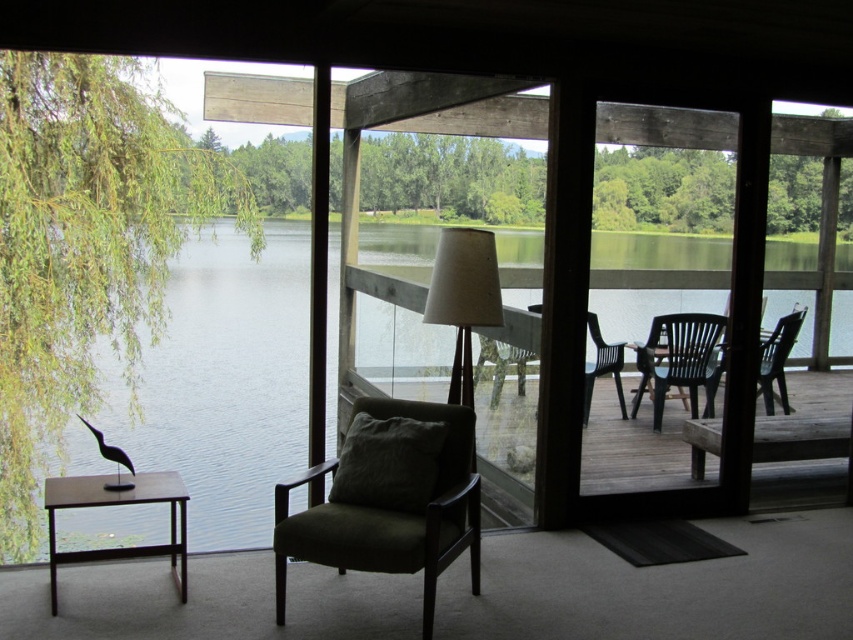
Can you confirm if transparent glass screen door at center is thinner than green water at center?

Yes, transparent glass screen door at center is thinner than green water at center.

Does transparent glass screen door at center appear over green water at center?

Yes.

Who is more forward, (428, 250) or (244, 474)?

Point (244, 474) is in front.

Find the location of a particular element. The height and width of the screenshot is (640, 853). transparent glass screen door at center is located at coordinates tap(426, 232).

Is dark green fabric armchair at center below white fabric lamp at center?

Yes, dark green fabric armchair at center is below white fabric lamp at center.

Is point (392, 452) closer to viewer compared to point (466, 337)?

Yes, point (392, 452) is in front of point (466, 337).

Does point (277, 504) lie behind point (476, 321)?

No, (277, 504) is closer to viewer.

I want to click on dark green fabric armchair at center, so click(x=389, y=499).

Can you confirm if dark green fabric armchair at center is shorter than matte brown table at left?

No, dark green fabric armchair at center is not shorter than matte brown table at left.

Consider the image. Measure the distance from dark green fabric armchair at center to matte brown table at left.

dark green fabric armchair at center and matte brown table at left are 35.31 inches apart.

Is point (428, 630) positioned before point (61, 508)?

That is True.

The image size is (853, 640). I want to click on dark green fabric armchair at center, so [x=389, y=499].